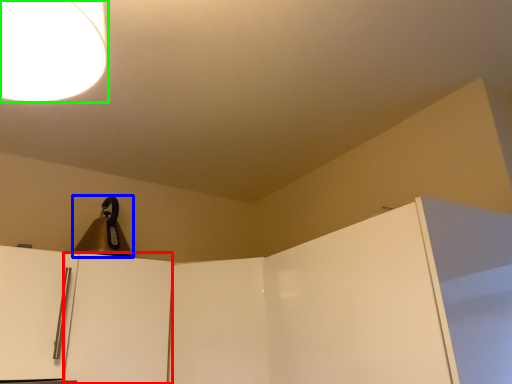
Question: Estimate the real-world distances between objects in this image. Which object is farther from door (highlighted by a red box), appliance (highlighted by a blue box) or lamp (highlighted by a green box)?

Choices:
 (A) appliance
 (B) lamp

Answer: (B)